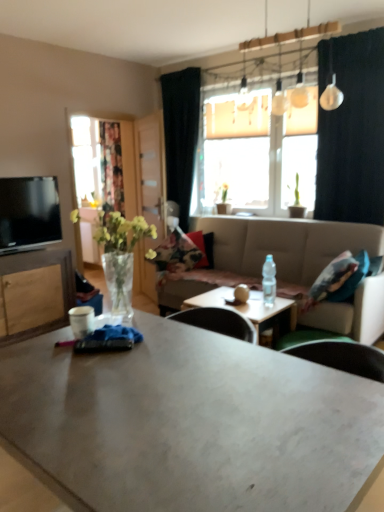
The height and width of the screenshot is (512, 384). In order to click on free location in front of clear glass vase at left in this screenshot , I will do `click(118, 350)`.